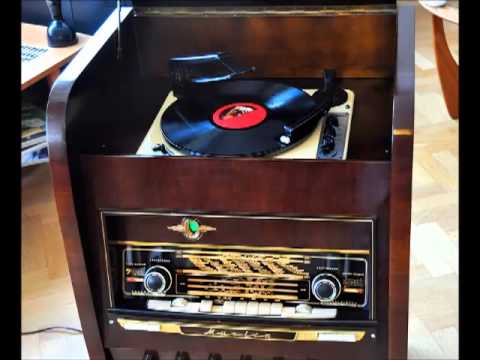
Locate an element on the screen. record player is located at coordinates [x=271, y=186].